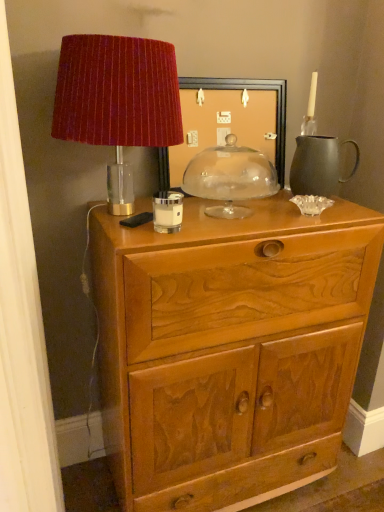
At what (x,y) coordinates should I click in order to perform the action: click on free space to the back side of white glass candle holder at center, which ranks as the 2th candle holder in right-to-left order. Please return your answer as a coordinate pair (x, y). The image size is (384, 512). Looking at the image, I should click on (188, 206).